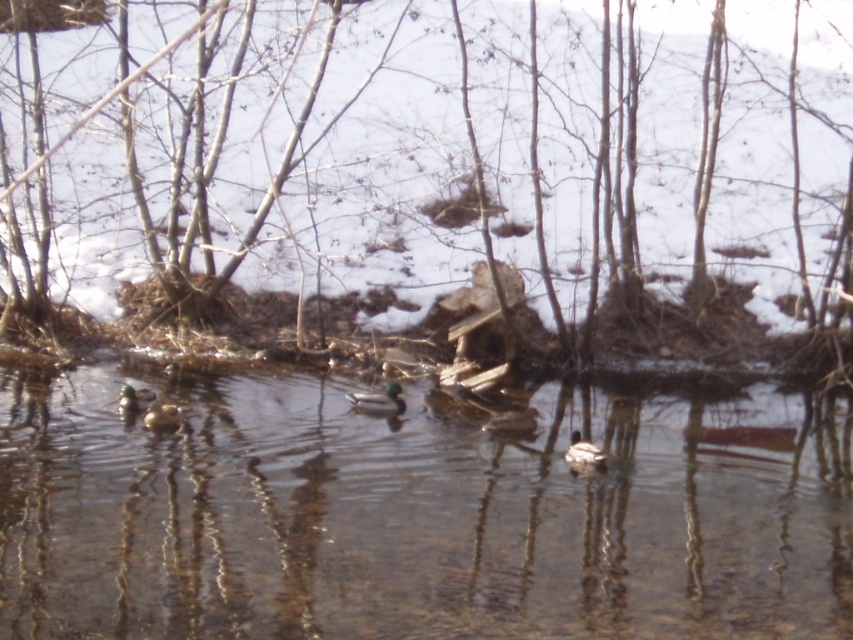
Question: Among these points, which one is farthest from the camera?

Choices:
 (A) (831, 442)
 (B) (151, 426)

Answer: (A)

Question: Which of these objects is positioned closest to the brown matte duck at lower left?

Choices:
 (A) brown wood at center
 (B) clear water at center
 (C) green matte duck at center

Answer: (C)

Question: Is brown matte duck at lower left below green glossy duck at lower left?

Choices:
 (A) no
 (B) yes

Answer: (B)

Question: Does clear water at center appear under green matte duck at center?

Choices:
 (A) no
 (B) yes

Answer: (B)

Question: Estimate the real-world distances between objects in this image. Which object is farther from the white matte duck at center?

Choices:
 (A) brown matte duck at lower left
 (B) clear water at center
 (C) green matte duck at center

Answer: (A)

Question: Does brown wood at center have a larger size compared to green glossy duck at lower left?

Choices:
 (A) yes
 (B) no

Answer: (A)